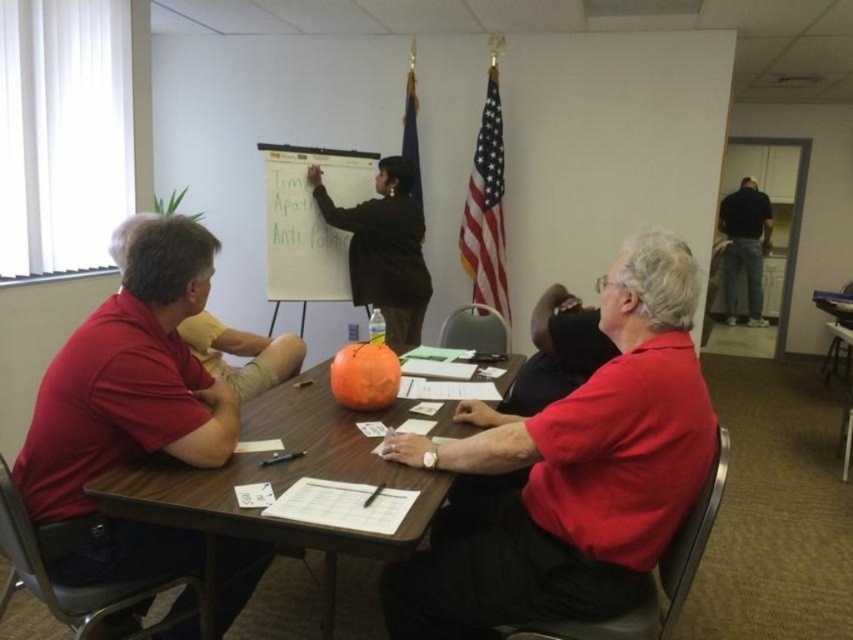
You are a photographer trying to capture a group photo of the people seated around the table. You want to ensure that everyone is visible in the photo. Given that the red matte shirt at center and the black smooth shirt at upper right are at different heights, which person should you position closer to the camera to ensure their full visibility?

The red matte shirt at center is shorter than the black smooth shirt at upper right, so positioning the red matte shirt at center closer to the camera will ensure their full visibility.

You are standing in the conference room and want to move from the whiteboard to the table. Which point, point (x=129, y=506) or point (x=764, y=228), is closer to you as you approach the table from the whiteboard?

Point (x=129, y=506) is closer to the viewer than point (x=764, y=228), so it would be the closer point when moving from the whiteboard to the table.

You are a photographer standing in the conference room and want to take a clear photo of the wooden table at center and the black smooth shirt at upper right. Which object should you focus on first to ensure both are in focus?

You should focus on the wooden table at center first since it is closer to the viewer than the black smooth shirt at upper right, so focusing on the closer object will help ensure both are in focus.